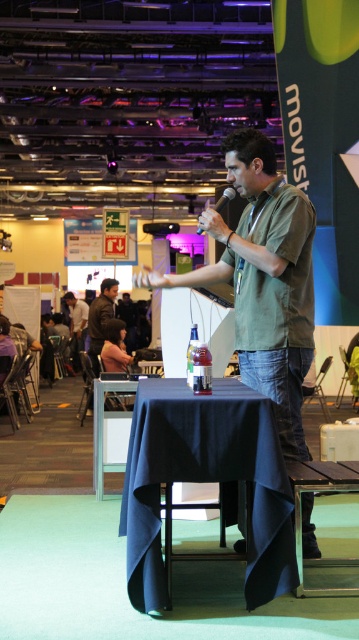
Is the position of dark blue fabric-covered table at center less distant than that of white glossy table at center?

Yes, it is.

Is dark blue fabric-covered table at center positioned behind white glossy table at center?

No, dark blue fabric-covered table at center is in front of white glossy table at center.

Who is more forward, (x=180, y=452) or (x=96, y=422)?

Positioned in front is point (x=180, y=452).

I want to click on dark blue fabric-covered table at center, so click(206, 481).

Is dark blue fabric-covered table at center bigger than green matte shirt at center?

Actually, dark blue fabric-covered table at center might be smaller than green matte shirt at center.

Which is in front, point (138, 589) or point (297, 429)?

Point (138, 589)

Measure the distance between dark blue fabric-covered table at center and camera.

The distance of dark blue fabric-covered table at center from camera is 8.60 feet.

This screenshot has width=359, height=640. What are the coordinates of `dark blue fabric-covered table at center` in the screenshot? It's located at (206, 481).

What are the coordinates of `dark blue fabric-covered table at center` in the screenshot? It's located at (206, 481).

Is dark blue fabric-covered table at center to the left of matte black shirt at center from the viewer's perspective?

No, dark blue fabric-covered table at center is not to the left of matte black shirt at center.

Does point (207, 460) lie behind point (86, 317)?

No, it is in front of (86, 317).

Identify the location of dark blue fabric-covered table at center. (206, 481).